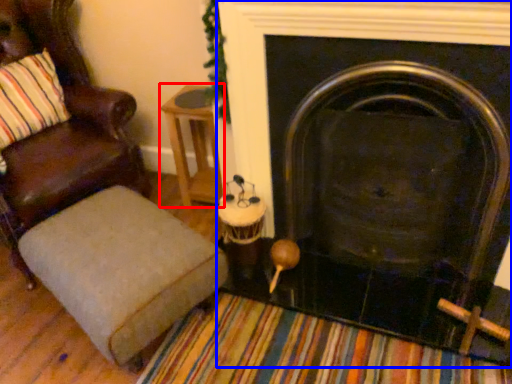
Question: Which point is further to the camera, side table (highlighted by a red box) or fireplace (highlighted by a blue box)?

Choices:
 (A) side table
 (B) fireplace

Answer: (A)